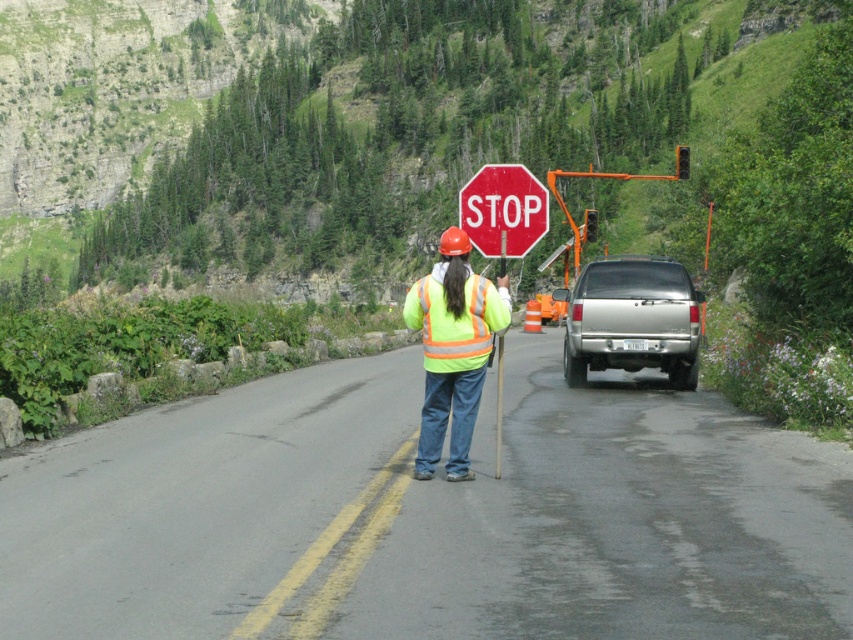
You are a driver approaching the reflective yellow safety vest at center and the red matte stop sign at center. Which object is positioned higher in the image?

The red matte stop sign at center is positioned higher than the reflective yellow safety vest at center in the image.